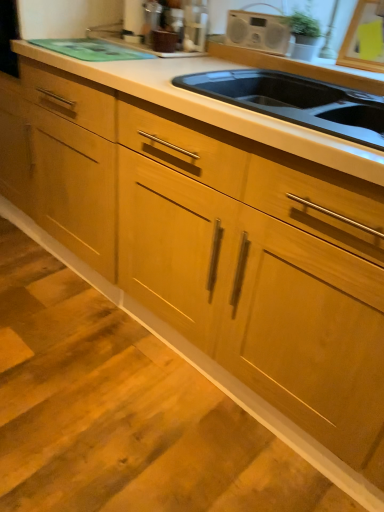
Question: Could you tell me if metallic silver toaster at upper center is facing black matte sink at center?

Choices:
 (A) yes
 (B) no

Answer: (B)

Question: Is metallic silver toaster at upper center closer to camera compared to black matte sink at center?

Choices:
 (A) yes
 (B) no

Answer: (B)

Question: Could black matte sink at center be considered to be inside metallic silver toaster at upper center?

Choices:
 (A) no
 (B) yes

Answer: (A)

Question: Is the position of metallic silver toaster at upper center more distant than that of black matte sink at center?

Choices:
 (A) no
 (B) yes

Answer: (B)

Question: From a real-world perspective, is metallic silver toaster at upper center over black matte sink at center?

Choices:
 (A) no
 (B) yes

Answer: (B)

Question: From the image's perspective, is metallic silver toaster at upper center under black matte sink at center?

Choices:
 (A) yes
 (B) no

Answer: (B)

Question: From a real-world perspective, is black matte sink at center under metallic silver toaster at upper center?

Choices:
 (A) no
 (B) yes

Answer: (B)

Question: Is black matte sink at center directly adjacent to metallic silver toaster at upper center?

Choices:
 (A) no
 (B) yes

Answer: (A)

Question: Is black matte sink at center located outside metallic silver toaster at upper center?

Choices:
 (A) yes
 (B) no

Answer: (A)

Question: Does black matte sink at center have a greater height compared to metallic silver toaster at upper center?

Choices:
 (A) no
 (B) yes

Answer: (A)

Question: Is the depth of black matte sink at center greater than that of metallic silver toaster at upper center?

Choices:
 (A) no
 (B) yes

Answer: (A)

Question: From the image's perspective, is black matte sink at center beneath metallic silver toaster at upper center?

Choices:
 (A) yes
 (B) no

Answer: (A)

Question: Is metallic silver toaster at upper center in front of or behind black matte sink at center in the image?

Choices:
 (A) behind
 (B) front

Answer: (A)